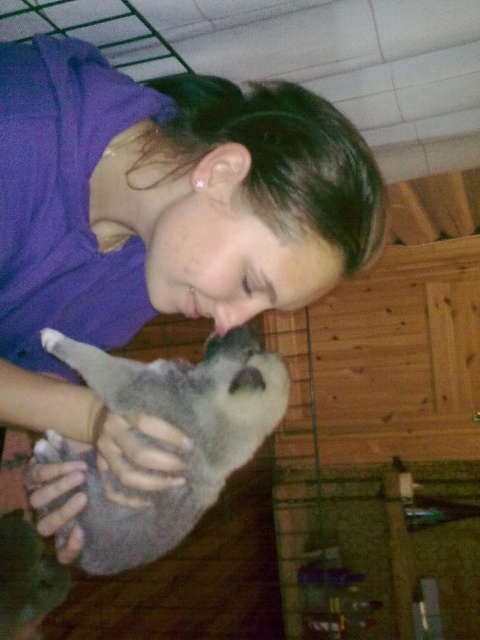
Who is lower down, purple fabric at upper left or fuzzy gray cat at center?

fuzzy gray cat at center is below.

Does purple fabric at upper left have a lesser width compared to fuzzy gray cat at center?

No, purple fabric at upper left is not thinner than fuzzy gray cat at center.

This screenshot has height=640, width=480. I want to click on purple fabric at upper left, so click(x=167, y=198).